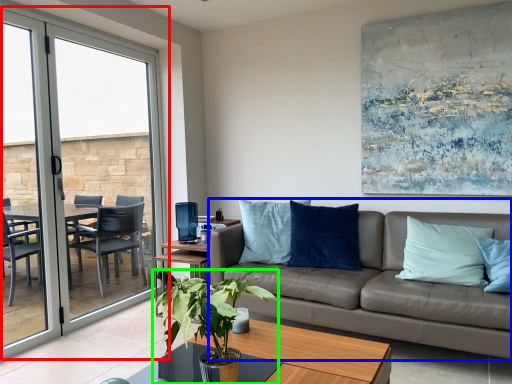
Question: Considering the real-world distances, which object is closest to window (highlighted by a red box)? studio couch (highlighted by a blue box) or houseplant (highlighted by a green box).

Choices:
 (A) studio couch
 (B) houseplant

Answer: (A)